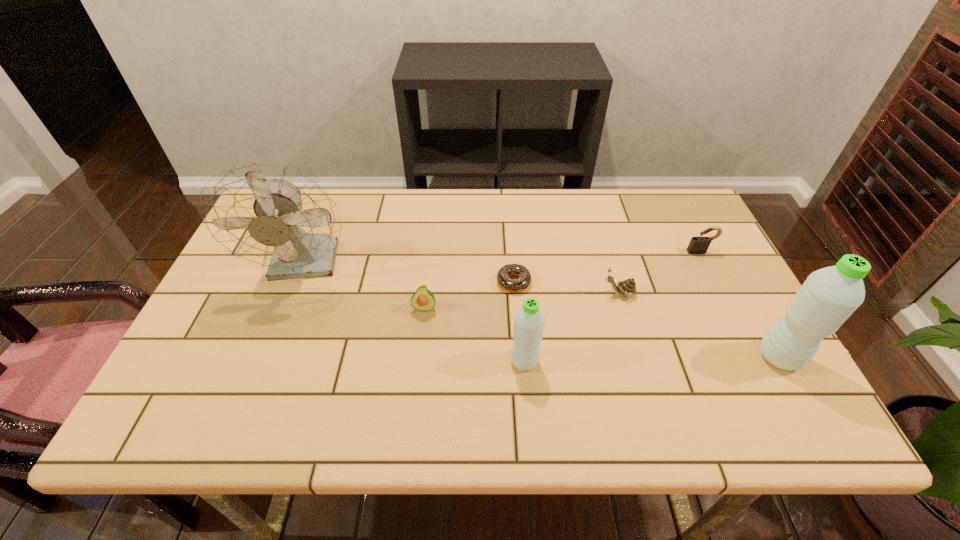
The width and height of the screenshot is (960, 540). I want to click on the shorter water bottle, so pos(529,320).

The image size is (960, 540). I want to click on the fifth shortest object, so click(x=529, y=320).

Locate an element on the screen. the sixth shortest object is located at coordinates (828, 297).

The image size is (960, 540). I want to click on the right water bottle, so click(x=828, y=297).

This screenshot has height=540, width=960. I want to click on the tallest object, so click(x=270, y=216).

Find the location of a particular element. Image resolution: width=960 pixels, height=540 pixels. fan is located at coordinates (270, 216).

Where is `snail`? The image size is (960, 540). snail is located at coordinates (627, 287).

Locate an element on the screen. Image resolution: width=960 pixels, height=540 pixels. avocado is located at coordinates (423, 300).

Locate an element on the screen. This screenshot has height=540, width=960. the sixth object from right to left is located at coordinates (423, 300).

Where is `doughnut`? doughnut is located at coordinates (523, 282).